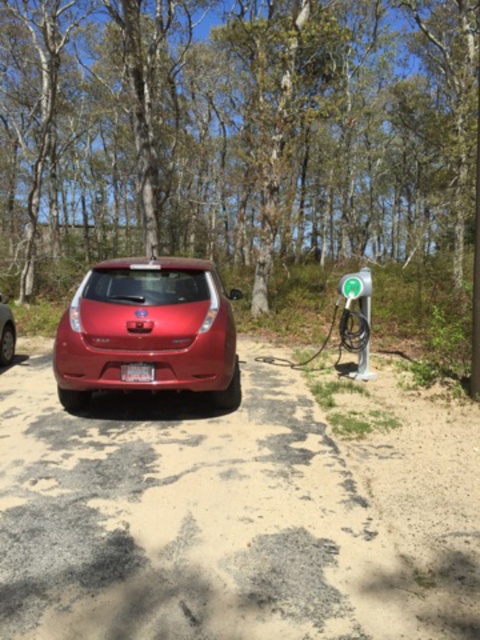
Question: Does glossy red car at center lie behind shiny red car at center?

Choices:
 (A) no
 (B) yes

Answer: (A)

Question: Does green plastic parking meter at center have a lesser width compared to shiny red car at center?

Choices:
 (A) yes
 (B) no

Answer: (B)

Question: Which point is farther to the camera?

Choices:
 (A) green plastic parking meter at center
 (B) glossy red car at center

Answer: (A)

Question: Which point appears closest to the camera in this image?

Choices:
 (A) (0, 310)
 (B) (348, 291)
 (C) (166, 301)

Answer: (C)

Question: Which object appears farthest from the camera in this image?

Choices:
 (A) shiny red car at center
 (B) glossy red car at center

Answer: (A)

Question: Is green plastic parking meter at center thinner than shiny red car at center?

Choices:
 (A) no
 (B) yes

Answer: (A)